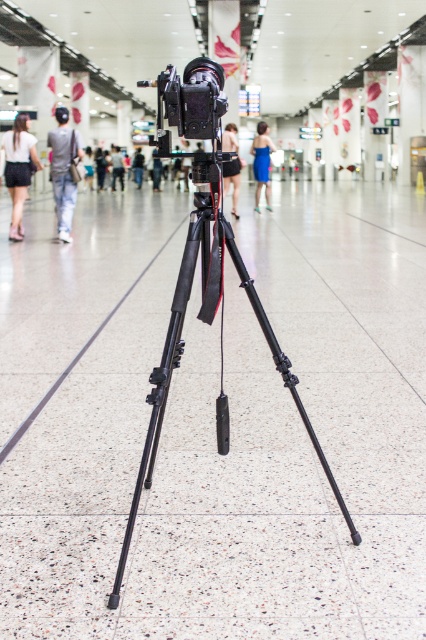
You are a photographer setting up equipment. You have a black matte tripod at center and a blue satin dress at center. Which object takes up more space in the image?

The black matte tripod at center is larger in size than the blue satin dress at center, so it takes up more space in the image.

You are a photographer who needs to adjust the camera position. The camera must be moved closer to the tripod to ensure stability. Is the current distance between the black matte tripod at center and the camera sufficient for stability, or does it need to be adjusted?

The black matte tripod at center is 1.57 meters away from the camera, which is likely too far for stable positioning. The camera should be moved closer to the tripod to ensure stability.